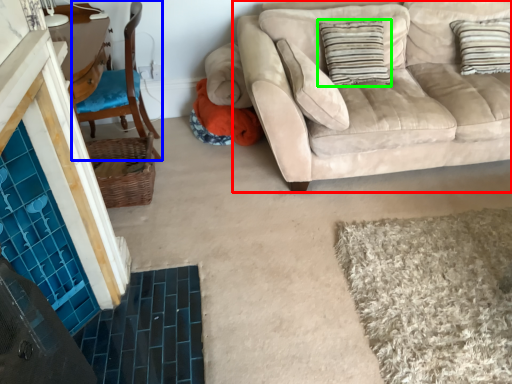
Question: Which object is positioned closest to studio couch (highlighted by a red box)? Select from chair (highlighted by a blue box) and pillow (highlighted by a green box).

Choices:
 (A) chair
 (B) pillow

Answer: (B)